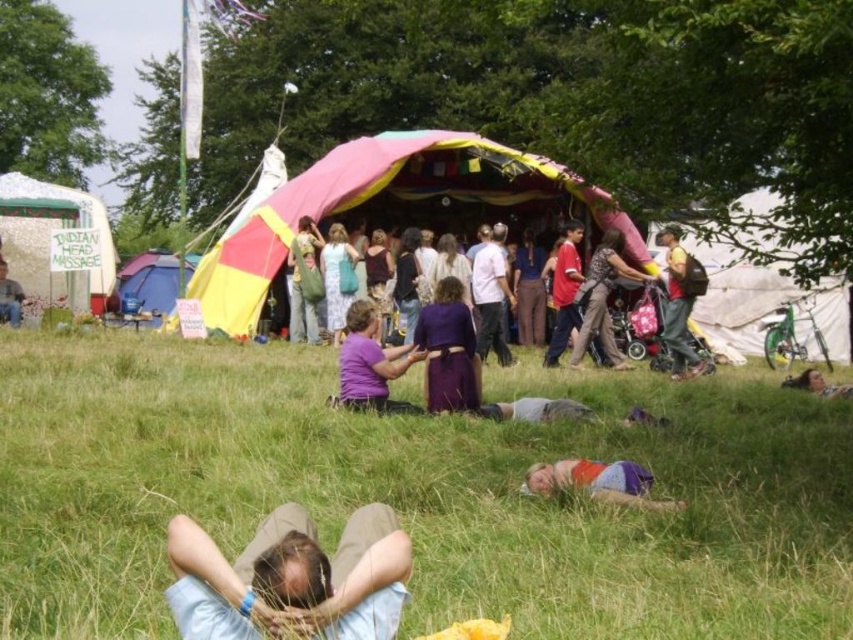
Which is behind, point (234, 243) or point (340, 380)?

The point (234, 243) is behind.

Is multicolored fabric tent at center taller than purple matte shirt at center?

Yes, multicolored fabric tent at center is taller than purple matte shirt at center.

This screenshot has width=853, height=640. I want to click on multicolored fabric tent at center, so click(x=384, y=204).

Does purple fabric dress at center have a greater height compared to blue fabric tent at left?

Correct, purple fabric dress at center is much taller as blue fabric tent at left.

Between point (456, 378) and point (132, 264), which one is positioned in front?

Point (456, 378) is more forward.

This screenshot has width=853, height=640. I want to click on purple fabric dress at center, so click(448, 349).

Is green fabric bag at center above light brown hair at lower right?

Yes.

In the scene shown: Which is more to the left, green fabric bag at center or light brown hair at lower right?

Positioned to the left is green fabric bag at center.

Which is in front, point (294, 273) or point (811, 371)?

Point (811, 371)

Locate an element on the screen. green fabric bag at center is located at coordinates (305, 282).